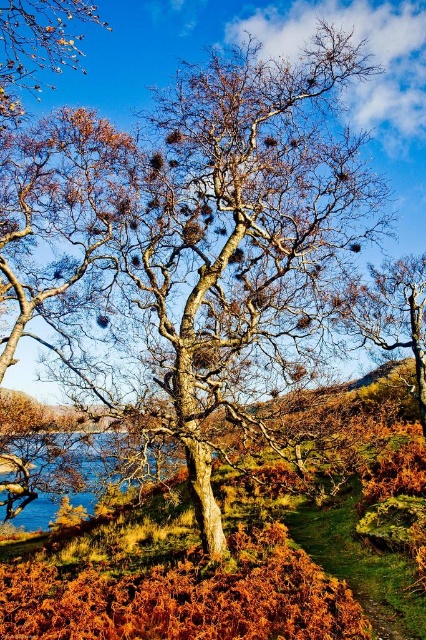
You are standing in the middle of the scene and see the point at coordinates point (37, 45). Based on the description, what object is this point located on?

The point (37, 45) is located on the smooth brown tree at upper left.

In the scene shown: You are an artist sketching the scene and want to draw the smooth brown tree at upper left and the smooth bark tree at center. Which tree should you draw first if you are following the natural order from front to back?

You should draw the smooth bark tree at center first because it is positioned behind the smooth brown tree at upper left, so you need to draw the background elements before the foreground ones.